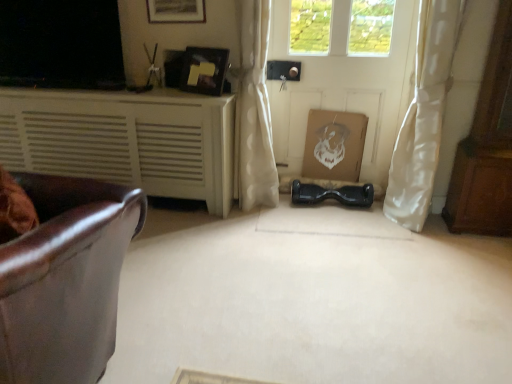
Question: From a real-world perspective, is matte black picture frame at upper center, the 1th picture frame ordered from the bottom, below white matte cabinet at left?

Choices:
 (A) no
 (B) yes

Answer: (A)

Question: Considering the relative sizes of matte black picture frame at upper center, acting as the second picture frame starting from the top, and white matte cabinet at left in the image provided, is matte black picture frame at upper center, acting as the second picture frame starting from the top, smaller than white matte cabinet at left?

Choices:
 (A) yes
 (B) no

Answer: (A)

Question: Is matte black picture frame at upper center, the 1th picture frame ordered from the bottom, outside white matte cabinet at left?

Choices:
 (A) yes
 (B) no

Answer: (A)

Question: Can you confirm if matte black picture frame at upper center, acting as the second picture frame starting from the top, is taller than white matte cabinet at left?

Choices:
 (A) yes
 (B) no

Answer: (B)

Question: Is matte black picture frame at upper center, the 1th picture frame ordered from the bottom, next to white matte cabinet at left and touching it?

Choices:
 (A) no
 (B) yes

Answer: (A)

Question: Is white matte cabinet at left inside matte black picture frame at upper center, the 1th picture frame ordered from the bottom?

Choices:
 (A) no
 (B) yes

Answer: (A)

Question: From the image's perspective, does matte black hoverboard at center appear higher than brown wooden dresser at right?

Choices:
 (A) no
 (B) yes

Answer: (A)

Question: Considering the relative positions of matte black hoverboard at center and brown wooden dresser at right in the image provided, is matte black hoverboard at center behind brown wooden dresser at right?

Choices:
 (A) yes
 (B) no

Answer: (B)

Question: Is matte black hoverboard at center not inside brown wooden dresser at right?

Choices:
 (A) no
 (B) yes

Answer: (B)

Question: Is matte black hoverboard at center to the right of brown wooden dresser at right from the viewer's perspective?

Choices:
 (A) yes
 (B) no

Answer: (B)

Question: Is matte black hoverboard at center positioned with its back to brown wooden dresser at right?

Choices:
 (A) no
 (B) yes

Answer: (A)

Question: Is matte black hoverboard at center in contact with brown wooden dresser at right?

Choices:
 (A) yes
 (B) no

Answer: (B)

Question: Is there a large distance between white sheer curtain at right, the 1th curtain viewed from the right, and wooden picture frame at upper center, which is counted as the second picture frame, starting from the bottom?

Choices:
 (A) yes
 (B) no

Answer: (A)